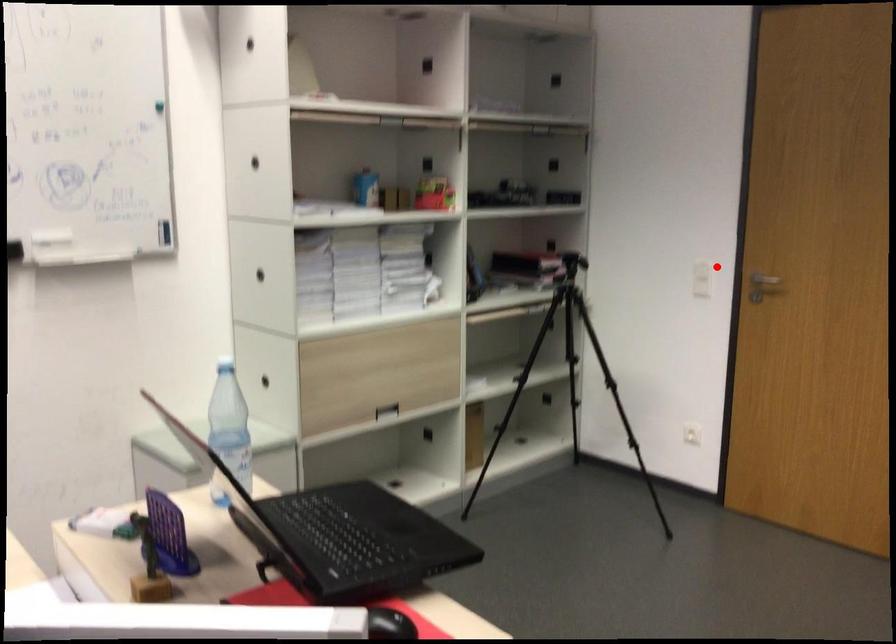
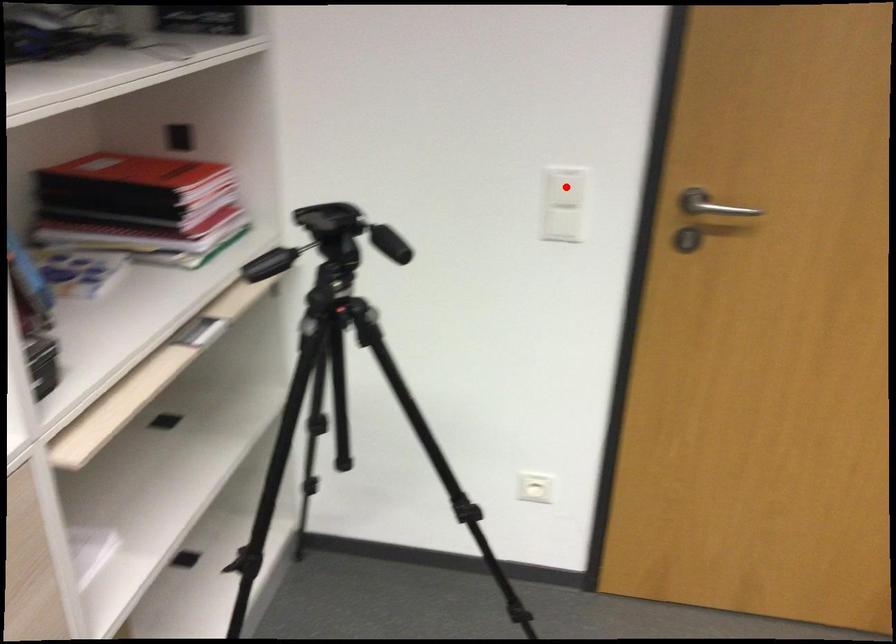
I am providing you with two images of the same scene from different viewpoints. A red point is marked on the first image and another point is marked on the second image. Does the point marked in image1 correspond to the same location as the one in image2?

Yes